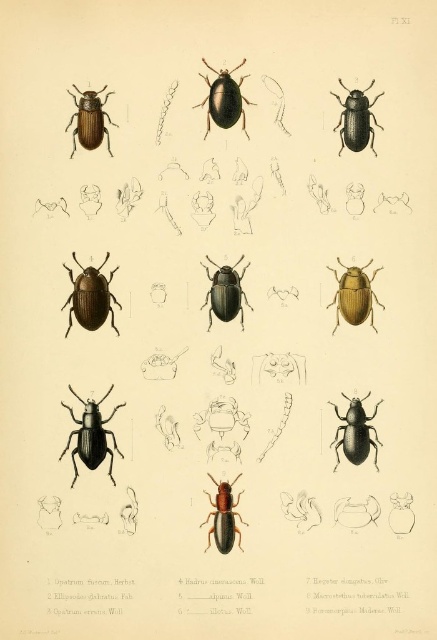
Find the location of a particular element. This screenshot has width=437, height=640. black matte beetle at center is located at coordinates (356, 433).

Does point (336, 416) come farther from viewer compared to point (361, 99)?

Yes, it is behind point (361, 99).

At what (x,y) coordinates should I click in order to perform the action: click on black matte beetle at center. Please return your answer as a coordinate pair (x, y). This screenshot has width=437, height=640. Looking at the image, I should click on (356, 433).

Who is positioned more to the right, black matte beetle at lower left or shiny brown beetle at upper left?

Positioned to the right is black matte beetle at lower left.

Can you confirm if black matte beetle at lower left is positioned above shiny brown beetle at upper left?

No, black matte beetle at lower left is not above shiny brown beetle at upper left.

Is point (89, 435) farther from camera compared to point (83, 124)?

No, it is in front of (83, 124).

Locate an element on the screen. black matte beetle at lower left is located at coordinates (90, 435).

Can you confirm if black matte beetle at lower left is positioned below shiny black beetle at upper right?

Yes, black matte beetle at lower left is below shiny black beetle at upper right.

Measure the distance between point (93, 432) and camera.

Point (93, 432) is 1.83 meters from camera.

Identify the location of black matte beetle at lower left. Image resolution: width=437 pixels, height=640 pixels. (90, 435).